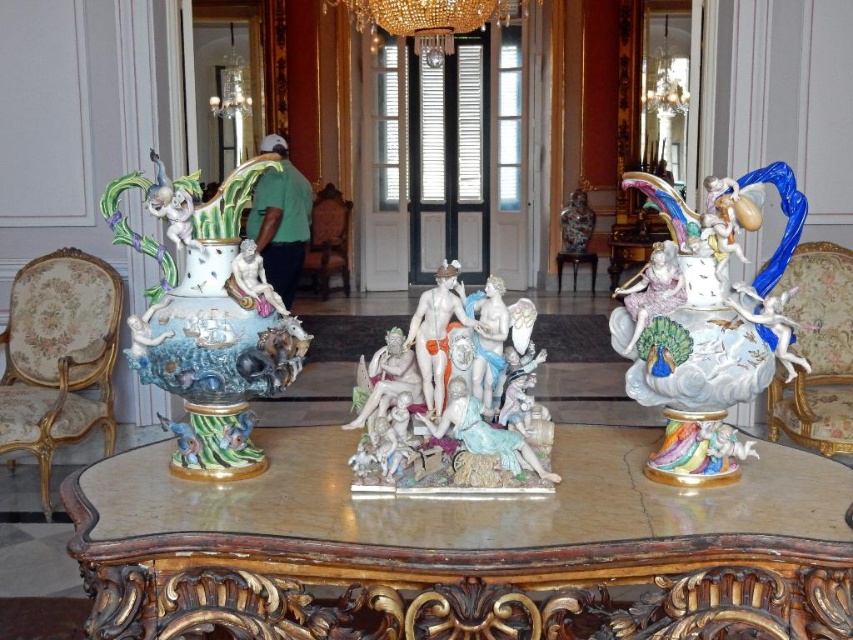
Question: Among these objects, which one is nearest to the camera?

Choices:
 (A) crystal glass chandelier at upper center
 (B) porcelain sculpture at center
 (C) wooden side table at center

Answer: (B)

Question: Is porcelain vase with colorful glaze at left behind velvet floral-patterned armchair at right?

Choices:
 (A) no
 (B) yes

Answer: (A)

Question: Considering the real-world distances, which object is farthest from the crystal glass chandelier at upper center?

Choices:
 (A) velvet floral-patterned armchair at right
 (B) floral fabric armchair at left

Answer: (B)

Question: Can you confirm if porcelain sculpture at center is positioned to the left of velvet floral-patterned armchair at right?

Choices:
 (A) yes
 (B) no

Answer: (A)

Question: From the image, what is the correct spatial relationship of brown leather armchair at center in relation to wooden side table at center?

Choices:
 (A) left
 (B) right

Answer: (A)

Question: Among these points, which one is nearest to the camera?

Choices:
 (A) (773, 410)
 (B) (578, 200)
 (C) (422, 17)
 (D) (701, 552)

Answer: (D)